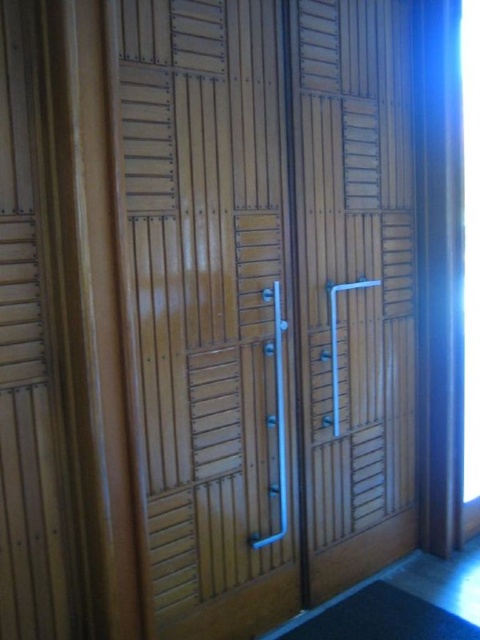
Question: Among these objects, which one is nearest to the camera?

Choices:
 (A) wooden at center
 (B) wooden slats at left

Answer: (B)

Question: Which point is closer to the camera taking this photo?

Choices:
 (A) (54, 636)
 (B) (225, 259)

Answer: (A)

Question: Considering the relative positions of wooden at center and wooden slats at left in the image provided, where is wooden at center located with respect to wooden slats at left?

Choices:
 (A) above
 (B) below

Answer: (A)

Question: Is wooden at center wider than wooden slats at left?

Choices:
 (A) no
 (B) yes

Answer: (B)

Question: Which object is closer to the camera taking this photo?

Choices:
 (A) wooden at center
 (B) wooden slats at left

Answer: (B)

Question: In this image, where is wooden at center located relative to wooden slats at left?

Choices:
 (A) right
 (B) left

Answer: (A)